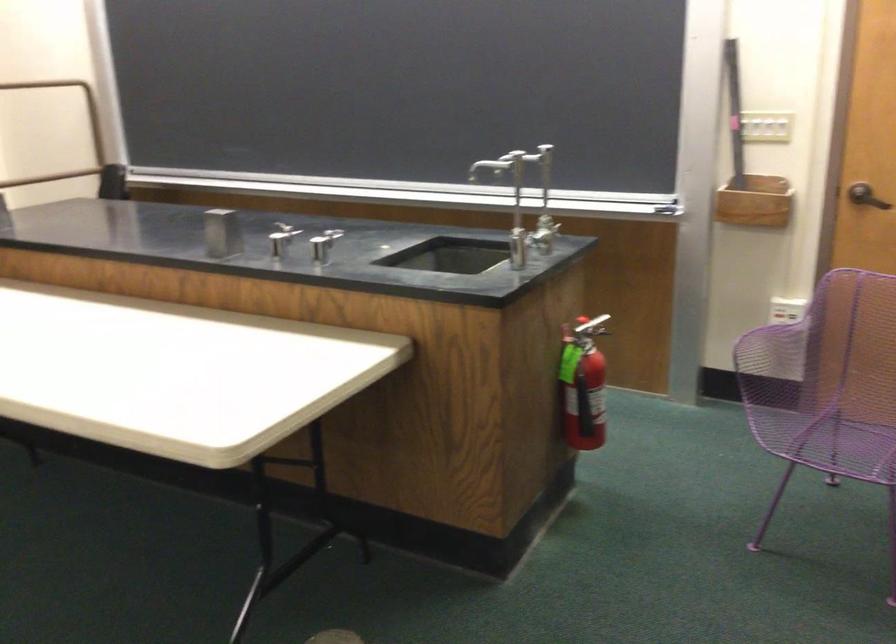
This screenshot has width=896, height=644. Describe the element at coordinates (866, 196) in the screenshot. I see `the door handle` at that location.